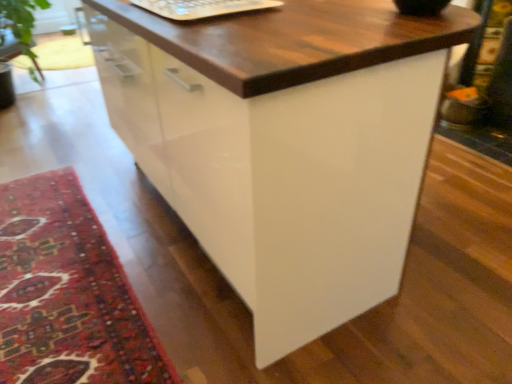
Question: Is white plastic laptop keyboard at upper center bigger than carpeted rug at lower left?

Choices:
 (A) yes
 (B) no

Answer: (B)

Question: Does white plastic laptop keyboard at upper center have a lesser height compared to carpeted rug at lower left?

Choices:
 (A) yes
 (B) no

Answer: (B)

Question: Is white plastic laptop keyboard at upper center at the left side of carpeted rug at lower left?

Choices:
 (A) no
 (B) yes

Answer: (A)

Question: Is white plastic laptop keyboard at upper center in contact with carpeted rug at lower left?

Choices:
 (A) no
 (B) yes

Answer: (A)

Question: Is white plastic laptop keyboard at upper center surrounding carpeted rug at lower left?

Choices:
 (A) yes
 (B) no

Answer: (B)

Question: Does white plastic laptop keyboard at upper center have a greater height compared to carpeted rug at lower left?

Choices:
 (A) yes
 (B) no

Answer: (A)

Question: Is carpeted rug at lower left not inside white plastic laptop keyboard at upper center?

Choices:
 (A) no
 (B) yes

Answer: (B)

Question: Is carpeted rug at lower left facing away from white plastic laptop keyboard at upper center?

Choices:
 (A) no
 (B) yes

Answer: (A)

Question: Is carpeted rug at lower left oriented towards white plastic laptop keyboard at upper center?

Choices:
 (A) yes
 (B) no

Answer: (B)

Question: Considering the relative sizes of carpeted rug at lower left and white plastic laptop keyboard at upper center in the image provided, is carpeted rug at lower left wider than white plastic laptop keyboard at upper center?

Choices:
 (A) no
 (B) yes

Answer: (B)

Question: From the image's perspective, is carpeted rug at lower left on white plastic laptop keyboard at upper center?

Choices:
 (A) yes
 (B) no

Answer: (B)

Question: Is carpeted rug at lower left taller than white plastic laptop keyboard at upper center?

Choices:
 (A) no
 (B) yes

Answer: (A)

Question: Considering the positions of white plastic laptop keyboard at upper center and carpeted rug at lower left in the image, is white plastic laptop keyboard at upper center taller or shorter than carpeted rug at lower left?

Choices:
 (A) short
 (B) tall

Answer: (B)